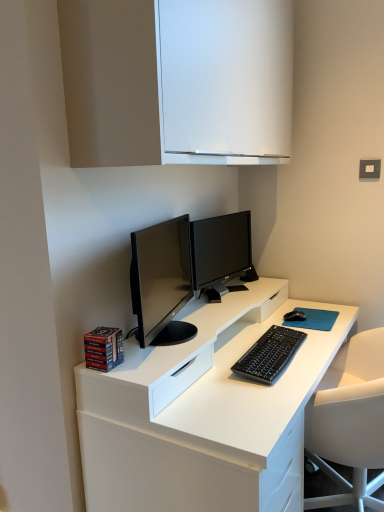
Image resolution: width=384 pixels, height=512 pixels. I want to click on unoccupied space behind hardcover book at lower left, so click(x=147, y=345).